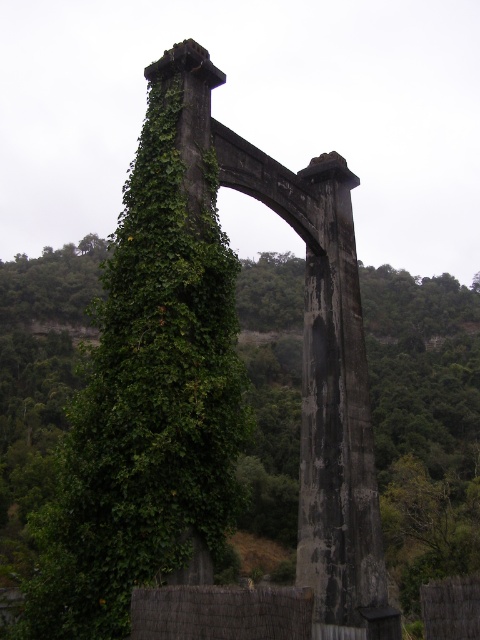
Question: Which object appears closest to the camera in this image?

Choices:
 (A) green leafy ivy at center
 (B) dark gray concrete pillar at center

Answer: (B)

Question: Which point is farther from the camera taking this photo?

Choices:
 (A) (287, 413)
 (B) (340, 593)

Answer: (A)

Question: Can you confirm if green leafy ivy at center is bigger than dark gray concrete pillar at center?

Choices:
 (A) yes
 (B) no

Answer: (A)

Question: Which point is farther to the camera?

Choices:
 (A) green leafy ivy at center
 (B) dark gray concrete pillar at center

Answer: (A)

Question: Where is green leafy ivy at center located in relation to dark gray concrete pillar at center in the image?

Choices:
 (A) above
 (B) below

Answer: (A)

Question: Does green leafy ivy at center have a greater width compared to dark gray concrete pillar at center?

Choices:
 (A) yes
 (B) no

Answer: (A)